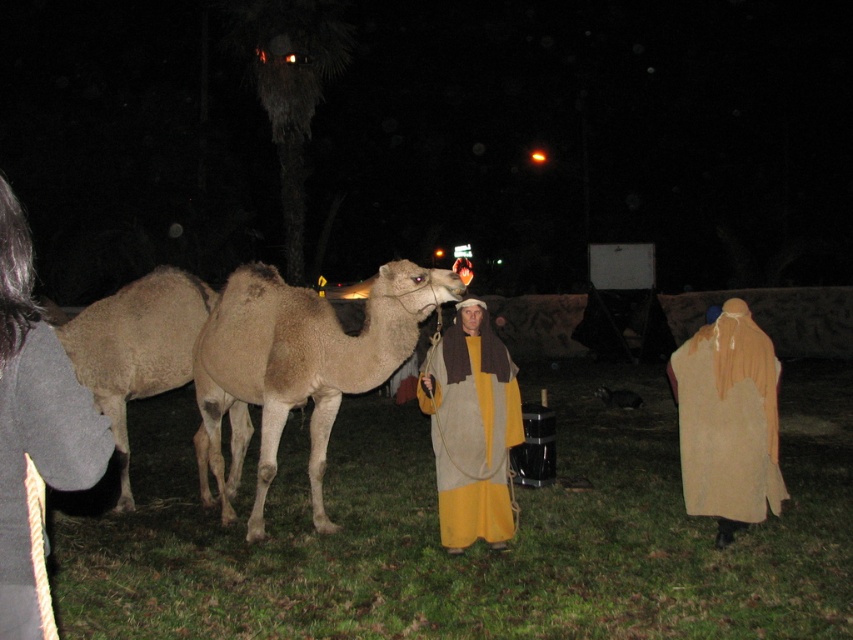
Does beige woolen camel at left have a greater width compared to beige cotton robe at lower left?

Yes.

Can you confirm if beige woolen camel at left is smaller than beige cotton robe at lower left?

Actually, beige woolen camel at left might be larger than beige cotton robe at lower left.

Where is `beige woolen camel at left`? beige woolen camel at left is located at coordinates (136, 348).

Does beige fabric robe at right come behind beige woolen camel at left?

No, beige fabric robe at right is closer to the viewer.

Does beige fabric robe at right appear over beige woolen camel at left?

No, beige fabric robe at right is not above beige woolen camel at left.

Locate an element on the screen. Image resolution: width=853 pixels, height=640 pixels. beige fabric robe at right is located at coordinates (728, 419).

Is point (231, 461) closer to viewer compared to point (770, 401)?

That is False.

Is point (224, 305) behind point (746, 333)?

Yes, point (224, 305) is behind point (746, 333).

Identify the location of light brown matte camel at center. (297, 365).